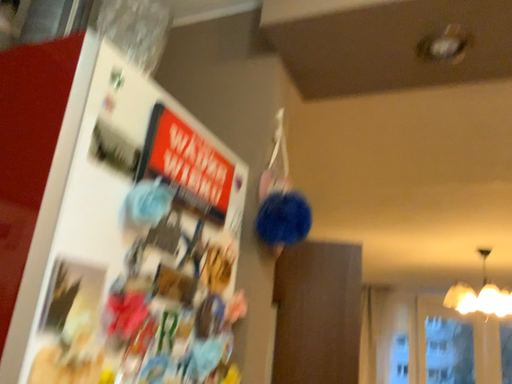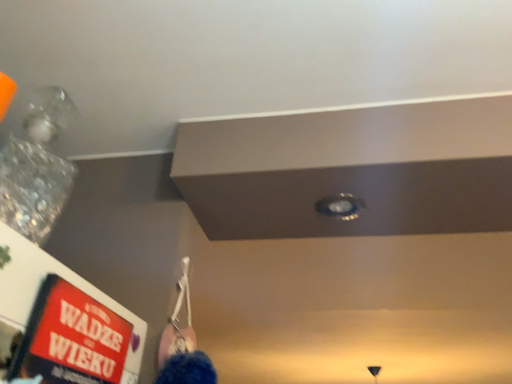
Question: Which way did the camera rotate in the video?

Choices:
 (A) rotated upward
 (B) rotated downward

Answer: (A)